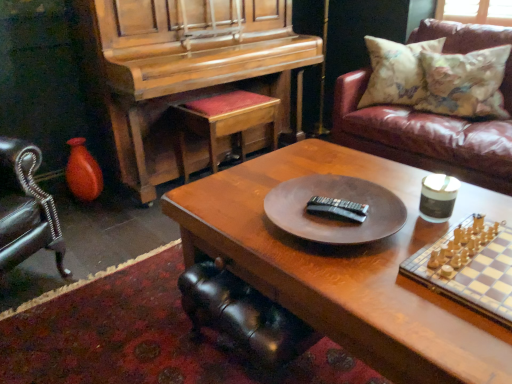
Identify the location of free location to the left of wooden chessboard at right. This screenshot has width=512, height=384. (395, 297).